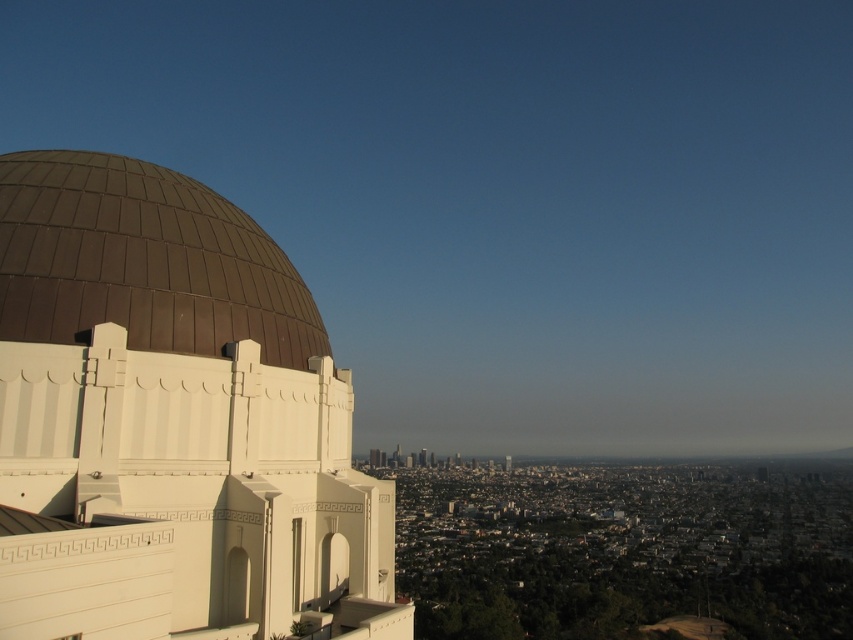
Does brown matte dome at upper left have a greater height compared to brown metallic dome at left?

Yes, brown matte dome at upper left is taller than brown metallic dome at left.

Is brown matte dome at upper left bigger than brown metallic dome at left?

Yes.

Who is more forward, (244, 413) or (77, 291)?

Positioned in front is point (77, 291).

Locate an element on the screen. The width and height of the screenshot is (853, 640). brown matte dome at upper left is located at coordinates (172, 422).